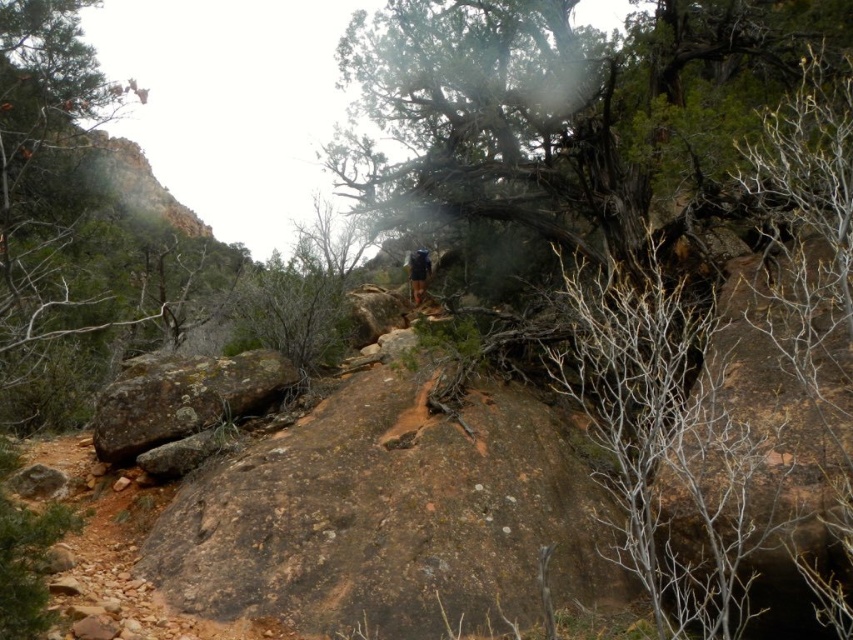
You are a hiker trying to navigate through the rocky terrain. You see the rusty brown rock at lower left and the dark blue jacket at center. Which object is positioned lower in the image?

The rusty brown rock at lower left is located below the dark blue jacket at center, so it is positioned lower in the image.

You are a hiker trying to navigate through the rocky terrain. There is a rusty brown rock at lower left and a dark blue jacket at center. Which object is positioned to the left of the other?

The rusty brown rock at lower left is to the left of the dark blue jacket at center.

You are a hiker standing at the point marked by the coordinates (183, 397) in the image. Based on the scene description, what object are you standing on?

The point at coordinates (183, 397) corresponds to the rusty brown rock at lower left, so you are standing on the rusty brown rock at lower left.